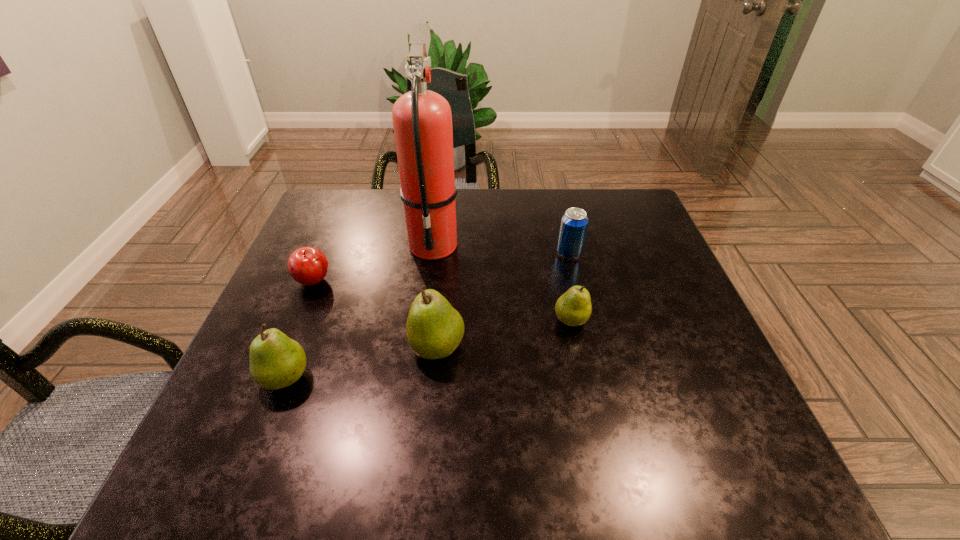
The width and height of the screenshot is (960, 540). I want to click on vacant point located on the back of the cherry, so click(x=336, y=226).

Locate an element on the screen. vacant space located on the hose direction of the fire extinguisher is located at coordinates (420, 354).

Identify the location of vacant space located 0.060m on the back of the beer can. (564, 232).

Locate an element on the screen. object that is at the far edge is located at coordinates (422, 121).

Locate an element on the screen. Image resolution: width=960 pixels, height=540 pixels. object present at the near edge is located at coordinates (276, 361).

You are a GUI agent. You are given a task and a screenshot of the screen. Output one action in this format:
    pyautogui.click(x=<x>, y=<y>)
    Task: Click on the pear located at the left edge
    
    Given the screenshot: What is the action you would take?
    pyautogui.click(x=276, y=361)

Locate an element on the screen. The height and width of the screenshot is (540, 960). cherry at the left edge is located at coordinates (308, 266).

You are a GUI agent. You are given a task and a screenshot of the screen. Output one action in this format:
    pyautogui.click(x=<x>, y=<y>)
    Task: Click on the object positioned at the near left corner
    The image size is (960, 540).
    Given the screenshot: What is the action you would take?
    pyautogui.click(x=276, y=361)

Locate an element on the screen. blank space at the far edge is located at coordinates (531, 218).

Image resolution: width=960 pixels, height=540 pixels. In the image, there is a desktop. Identify the location of vacant space at the near edge. point(355,408).